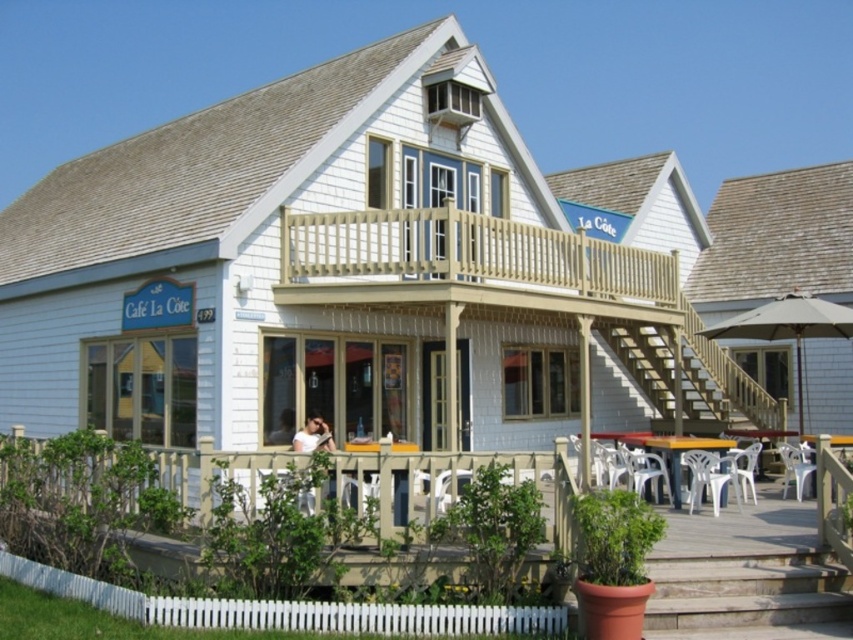
Question: Among these points, which one is farthest from the camera?

Choices:
 (A) (279, 436)
 (B) (642, 368)

Answer: (B)

Question: Which is farther from the smooth skin face at center?

Choices:
 (A) white fabric shirt at lower center
 (B) wooden stairs at center

Answer: (B)

Question: Considering the relative positions of wooden stairs at center and white fabric shirt at lower center in the image provided, where is wooden stairs at center located with respect to white fabric shirt at lower center?

Choices:
 (A) right
 (B) left

Answer: (A)

Question: Does white fabric shirt at lower center appear over smooth skin face at center?

Choices:
 (A) no
 (B) yes

Answer: (B)

Question: Is white fabric shirt at lower center smaller than smooth skin face at center?

Choices:
 (A) no
 (B) yes

Answer: (A)

Question: Which object is the farthest from the white fabric shirt at lower center?

Choices:
 (A) smooth skin face at center
 (B) wooden stairs at center

Answer: (B)